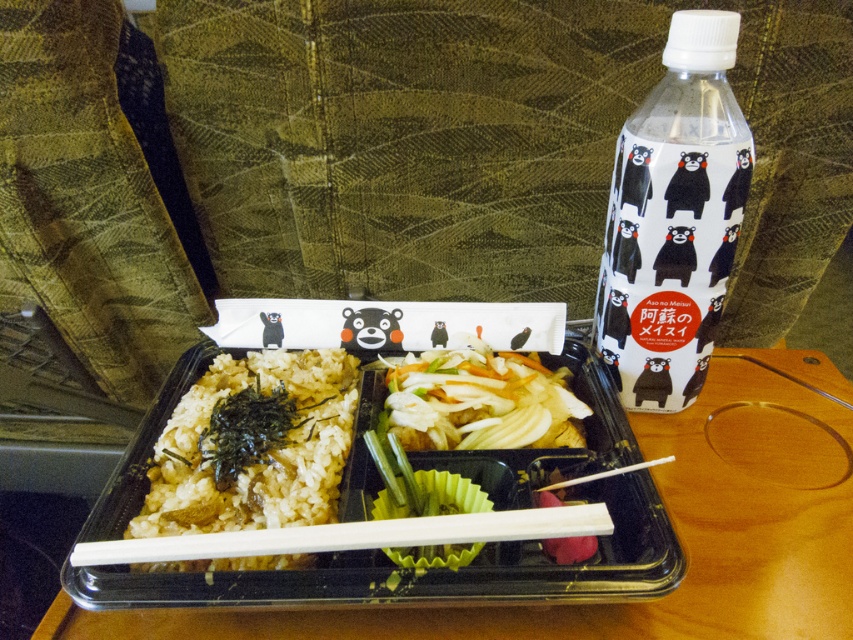
Looking at this image, you are looking at the bento box on the wooden table. Where is the white rice with seaweed at lower left positioned relative to the center of the bento box?

The white rice with seaweed at lower left is located at point [259,452], which means it is positioned to the right and slightly below the center of the bento box.

You are a guest at a restaurant and see the white plastic bottle at upper right on the table. If you want to reach it from your seat, which direction should you move your hand relative to the bento box?

The white plastic bottle at upper right is located at the upper right position relative to the bento box, so you should move your hand towards the upper right direction to reach it.

You are a customer at a restaurant and want to point out two specific points on the bento box to the waiter. The first point is at coordinate point(674,376) and the second is at point(508,396). The waiter asks which one is closer to you. How should you respond?

Point(674,376) is behind point(508,396), so the closer point to you is point(508,396).